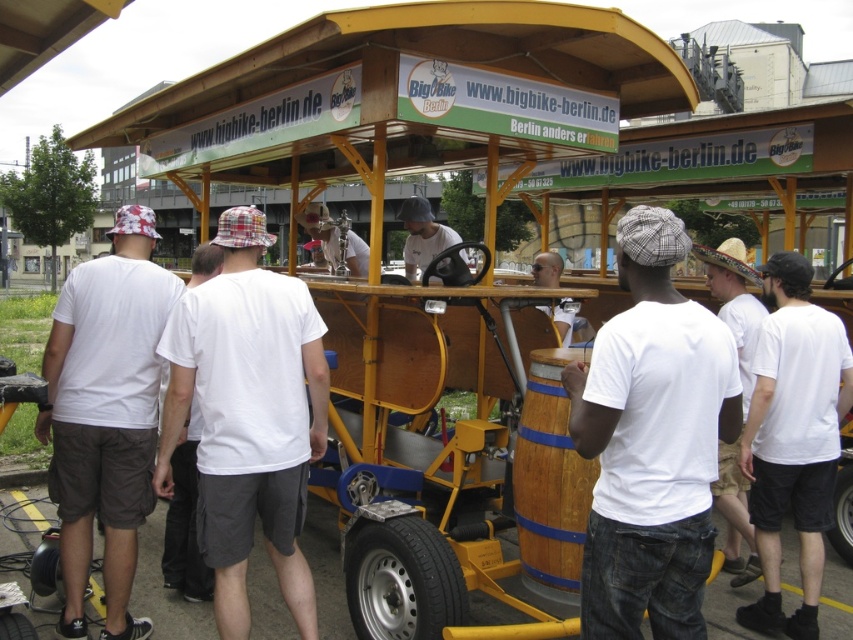
Image resolution: width=853 pixels, height=640 pixels. What do you see at coordinates (734, 301) in the screenshot?
I see `plaid fabric hat at center` at bounding box center [734, 301].

Is point (740, 529) farther from viewer compared to point (438, 236)?

No, it is not.

Which is behind, point (735, 273) or point (421, 241)?

Point (421, 241)

You are a GUI agent. You are given a task and a screenshot of the screen. Output one action in this format:
    pyautogui.click(x=<x>, y=<y>)
    Task: Click on the plaid fabric hat at center
    This screenshot has width=853, height=640.
    Given the screenshot: What is the action you would take?
    pos(734,301)

Does white cotton shirt at center appear on the left side of matte gray hat at center?

No, white cotton shirt at center is not to the left of matte gray hat at center.

Is white cotton shirt at center to the right of matte gray hat at center from the viewer's perspective?

Yes, white cotton shirt at center is to the right of matte gray hat at center.

Who is more forward, (824,472) or (419,252)?

Point (824,472)

Image resolution: width=853 pixels, height=640 pixels. In order to click on white cotton shirt at center in this screenshot , I will do `click(793, 438)`.

Between white matte shirt at center and plaid fabric hat at center, which one appears on the right side from the viewer's perspective?

Positioned to the right is plaid fabric hat at center.

Image resolution: width=853 pixels, height=640 pixels. What do you see at coordinates (651, 442) in the screenshot? I see `white matte shirt at center` at bounding box center [651, 442].

The height and width of the screenshot is (640, 853). Identify the location of white matte shirt at center. (651, 442).